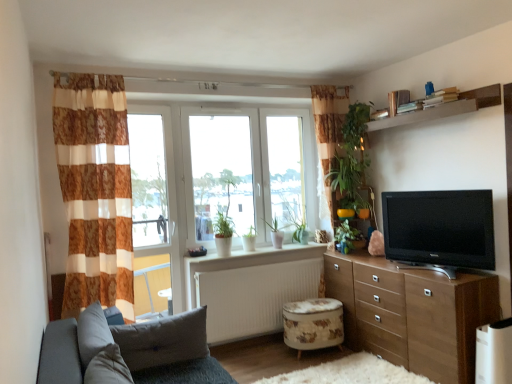
This screenshot has width=512, height=384. I want to click on free space that is to the left of floral fabric ottoman at lower center, so click(x=266, y=358).